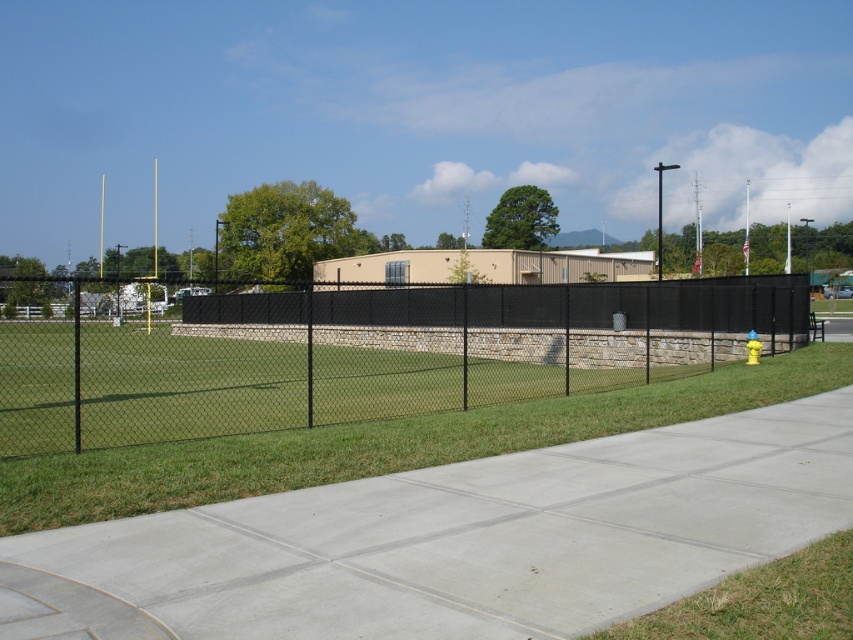
Question: Considering the real-world distances, which object is farthest from the green grass at lower right?

Choices:
 (A) black chain-link fence at center
 (B) gray concrete sidewalk at center

Answer: (A)

Question: Which object is farther from the camera taking this photo?

Choices:
 (A) gray concrete sidewalk at center
 (B) black chain-link fence at center
 (C) green grass at lower right

Answer: (B)

Question: Which of the following is the farthest from the observer?

Choices:
 (A) black chain-link fence at center
 (B) green grass at lower right

Answer: (A)

Question: Does gray concrete sidewalk at center appear under black chain-link fence at center?

Choices:
 (A) no
 (B) yes

Answer: (B)

Question: Does gray concrete sidewalk at center appear on the left side of green grass at lower right?

Choices:
 (A) no
 (B) yes

Answer: (B)

Question: In this image, where is black chain-link fence at center located relative to green grass at lower right?

Choices:
 (A) above
 (B) below

Answer: (A)